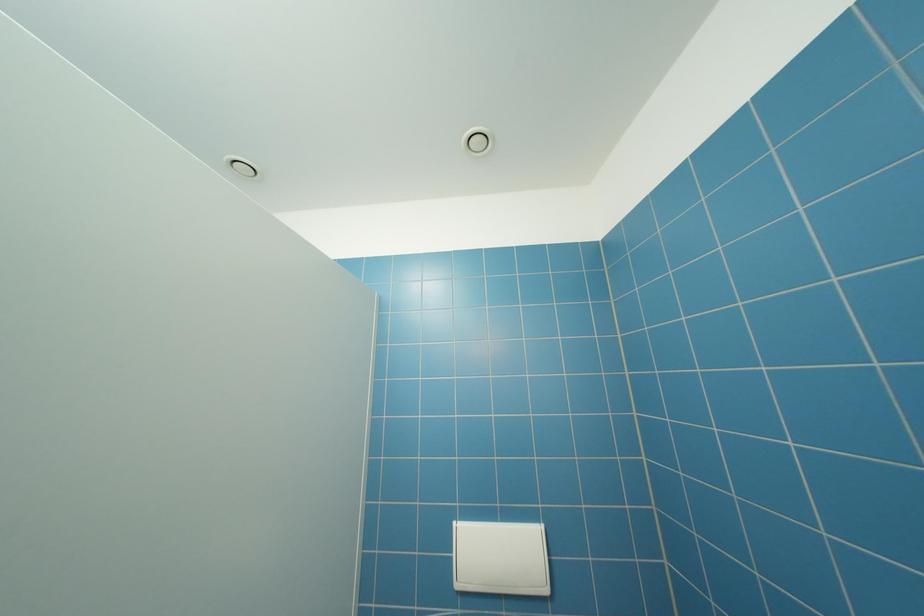
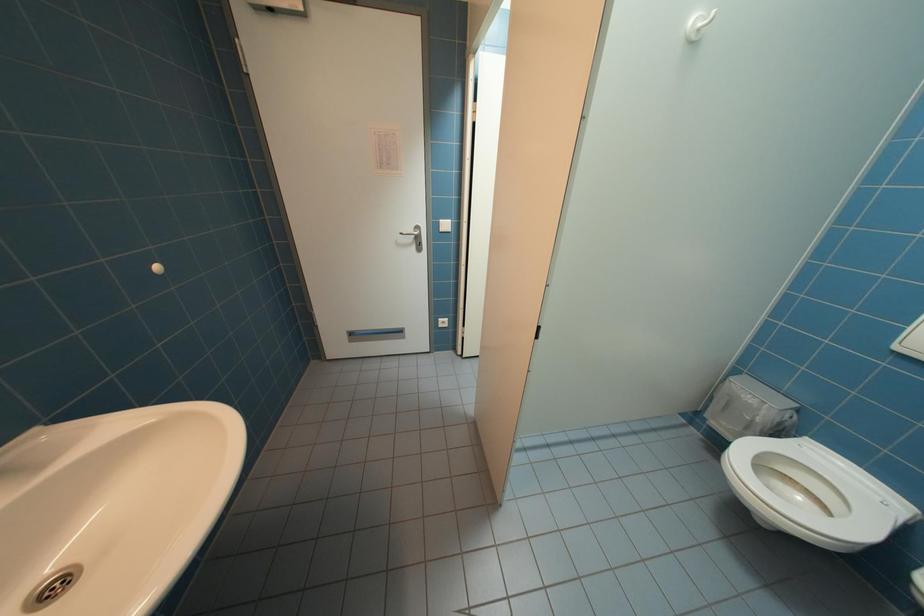
In the scene shown: First-person continuous shooting, in which direction is the camera rotating?

The rotation direction of the camera is left-down.